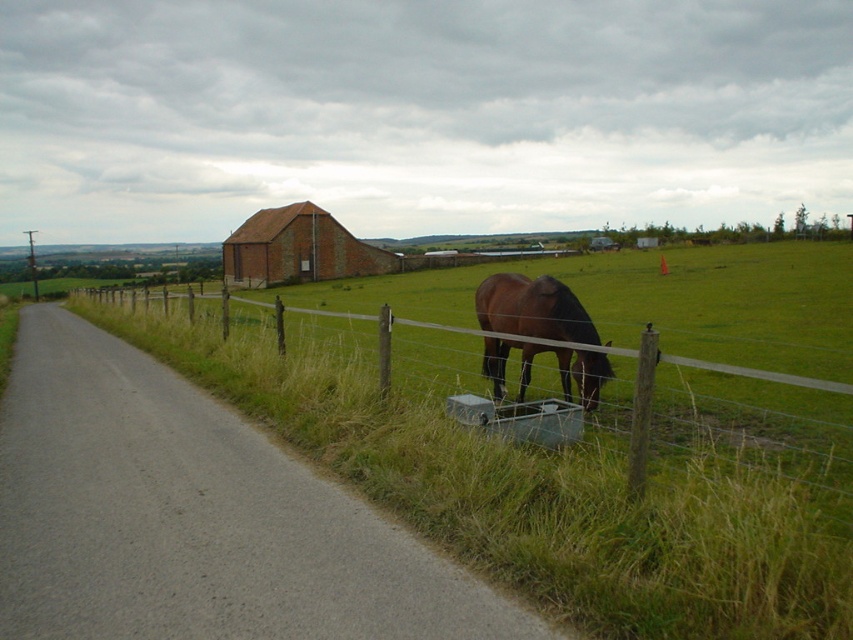
Does wire mesh fence at lower right have a greater height compared to brown glossy horse at center?

Indeed, wire mesh fence at lower right has a greater height compared to brown glossy horse at center.

Is point (672, 433) farther from viewer compared to point (575, 300)?

No, (672, 433) is in front of (575, 300).

Is point (759, 403) in front of point (492, 312)?

Yes, point (759, 403) is in front of point (492, 312).

The image size is (853, 640). Find the location of `wire mesh fence at lower right`. wire mesh fence at lower right is located at coordinates (750, 440).

Can you confirm if brown glossy horse at center is positioned to the right of brick red barn at center?

Indeed, brown glossy horse at center is positioned on the right side of brick red barn at center.

Between brown glossy horse at center and brick red barn at center, which one is positioned lower?

brown glossy horse at center is below.

Where is `brown glossy horse at center`? brown glossy horse at center is located at coordinates (532, 308).

Describe the element at coordinates (750, 440) in the screenshot. Image resolution: width=853 pixels, height=640 pixels. I see `wire mesh fence at lower right` at that location.

Measure the distance from wire mesh fence at lower right to brick red barn at center.

wire mesh fence at lower right is 37.13 meters from brick red barn at center.

Does point (821, 493) come in front of point (239, 282)?

Yes, point (821, 493) is closer to viewer.

Identify the location of wire mesh fence at lower right. (750, 440).